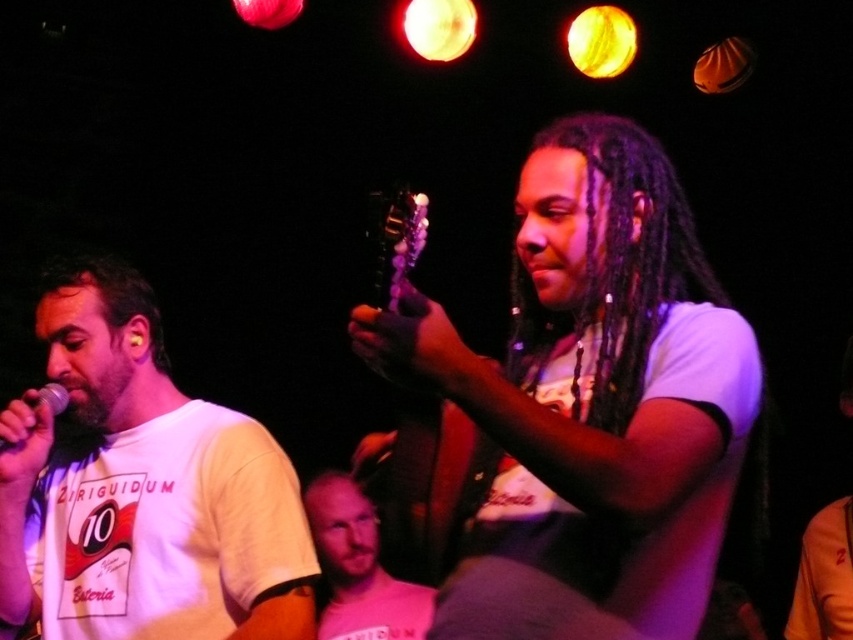
Question: Which point is farther to the camera?

Choices:
 (A) pos(50,388)
 (B) pos(379,285)
 (C) pos(322,540)

Answer: (C)

Question: Observing the image, what is the correct spatial positioning of white cotton t-shirt at left in reference to purple glossy guitar at center?

Choices:
 (A) below
 (B) above

Answer: (A)

Question: Is white cotton t-shirt at left positioned at the back of purple glossy guitar at center?

Choices:
 (A) yes
 (B) no

Answer: (A)

Question: Which point is farther from the camera taking this photo?

Choices:
 (A) (59, 362)
 (B) (402, 584)

Answer: (B)

Question: Which point appears farthest from the camera in this image?

Choices:
 (A) (352, 628)
 (B) (158, 392)
 (C) (45, 390)

Answer: (A)

Question: Does white cotton t-shirt at left have a larger size compared to purple glossy guitar at center?

Choices:
 (A) yes
 (B) no

Answer: (A)